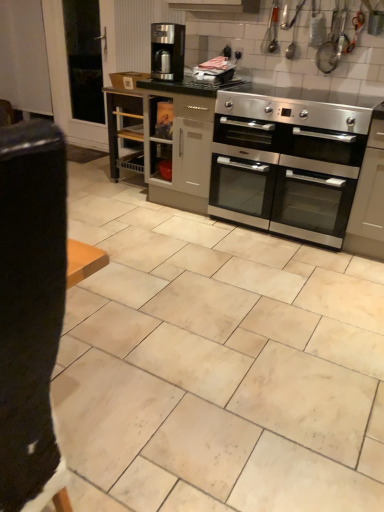
Question: Can you confirm if beige matte tile at center is positioned to the right of stainless steel oven at center?

Choices:
 (A) yes
 (B) no

Answer: (B)

Question: From a real-world perspective, is beige matte tile at center positioned under stainless steel oven at center based on gravity?

Choices:
 (A) yes
 (B) no

Answer: (A)

Question: Is beige matte tile at center facing away from stainless steel oven at center?

Choices:
 (A) yes
 (B) no

Answer: (B)

Question: Can you confirm if beige matte tile at center is smaller than stainless steel oven at center?

Choices:
 (A) no
 (B) yes

Answer: (A)

Question: Can you confirm if beige matte tile at center is shorter than stainless steel oven at center?

Choices:
 (A) yes
 (B) no

Answer: (A)

Question: Is beige matte tile at center positioned behind stainless steel oven at center?

Choices:
 (A) no
 (B) yes

Answer: (A)

Question: Can you confirm if beige matte tile at center is positioned to the right of satin black coffee maker at center?

Choices:
 (A) no
 (B) yes

Answer: (A)

Question: Does beige matte tile at center have a greater height compared to satin black coffee maker at center?

Choices:
 (A) yes
 (B) no

Answer: (B)

Question: Considering the relative sizes of beige matte tile at center and satin black coffee maker at center in the image provided, is beige matte tile at center thinner than satin black coffee maker at center?

Choices:
 (A) no
 (B) yes

Answer: (A)

Question: Does beige matte tile at center have a smaller size compared to satin black coffee maker at center?

Choices:
 (A) yes
 (B) no

Answer: (B)

Question: Is beige matte tile at center bigger than satin black coffee maker at center?

Choices:
 (A) no
 (B) yes

Answer: (B)

Question: Could you tell me if beige matte tile at center is turned towards satin black coffee maker at center?

Choices:
 (A) no
 (B) yes

Answer: (A)

Question: Considering the relative sizes of beige matte tile at center and satin grey cabinet at center in the image provided, is beige matte tile at center wider than satin grey cabinet at center?

Choices:
 (A) yes
 (B) no

Answer: (A)